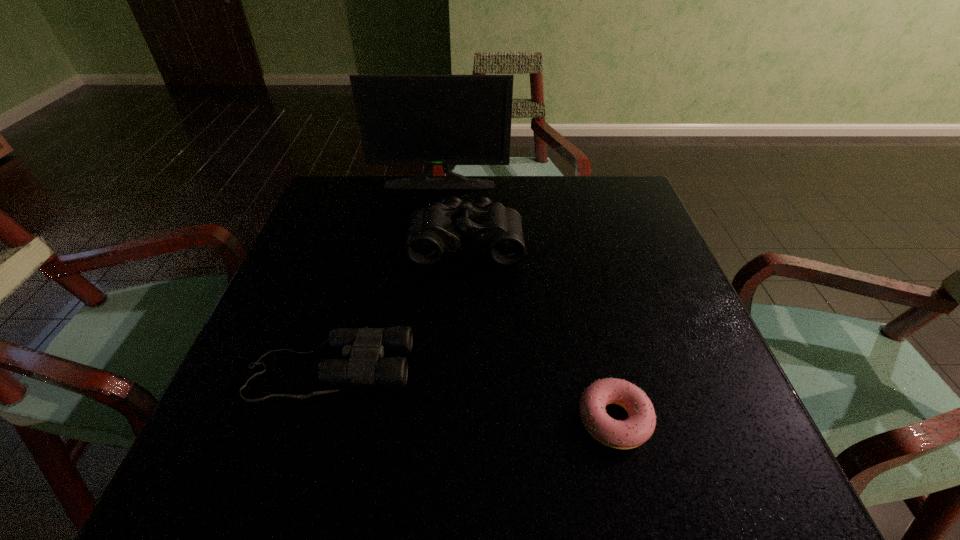
At what (x,y) coordinates should I click in order to perform the action: click on the farthest object. Please return your answer as a coordinate pair (x, y). The height and width of the screenshot is (540, 960). Looking at the image, I should click on (430, 120).

Locate an element on the screen. The height and width of the screenshot is (540, 960). monitor is located at coordinates (430, 120).

The width and height of the screenshot is (960, 540). In order to click on the farther binoculars in this screenshot , I will do `click(494, 229)`.

At what (x,y) coordinates should I click in order to perform the action: click on the taller binoculars. Please return your answer as a coordinate pair (x, y). The width and height of the screenshot is (960, 540). Looking at the image, I should click on (494, 229).

Image resolution: width=960 pixels, height=540 pixels. In order to click on the second shortest object in this screenshot , I will do `click(363, 348)`.

Identify the location of the nearer binoculars. The image size is (960, 540). (363, 348).

Image resolution: width=960 pixels, height=540 pixels. In order to click on the rightmost object in this screenshot , I will do `click(639, 426)`.

I want to click on the shortest object, so click(x=639, y=426).

Locate an element on the screen. vacant space located 0.050m on the front-facing side of the monitor is located at coordinates pyautogui.click(x=438, y=199).

Find the location of `free space located at the eyepieces of the taller binoculars`. free space located at the eyepieces of the taller binoculars is located at coordinates (460, 424).